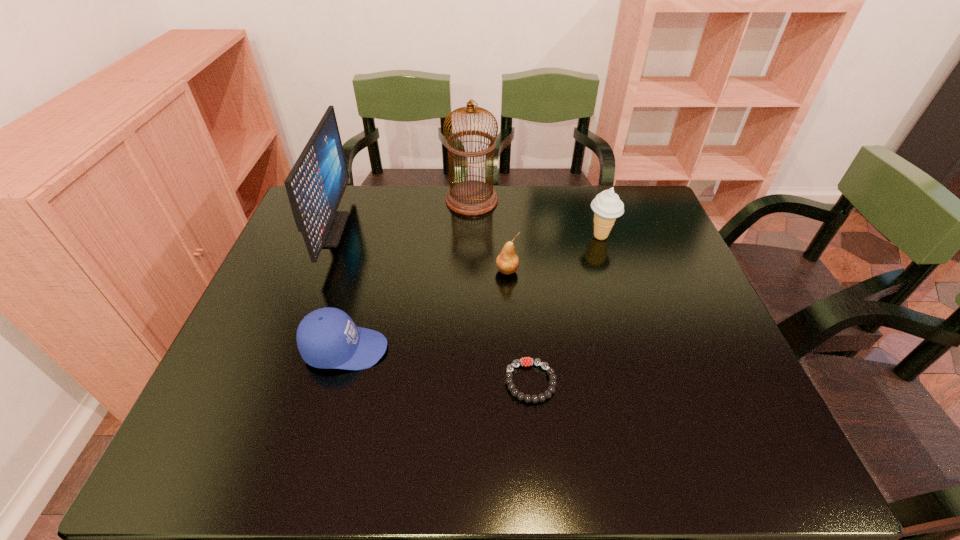
The image size is (960, 540). Identify the location of birdcage. (471, 197).

Where is `computer monitor`? The image size is (960, 540). computer monitor is located at coordinates (315, 185).

Locate an element on the screen. The width and height of the screenshot is (960, 540). icecream is located at coordinates (607, 206).

Identify the location of the rightmost object. (607, 206).

Identify the location of pear. The width and height of the screenshot is (960, 540). (507, 262).

What are the coordinates of `the second object from left to right` in the screenshot? It's located at (327, 338).

I want to click on cap, so click(x=327, y=338).

Image resolution: width=960 pixels, height=540 pixels. Find the location of `the shortest object`. the shortest object is located at coordinates [x=547, y=394].

Identify the location of blank space located 0.360m on the front-facing side of the birdcage. (608, 200).

Where is `blank area located on the screen side of the computer monitor`? The image size is (960, 540). blank area located on the screen side of the computer monitor is located at coordinates (394, 230).